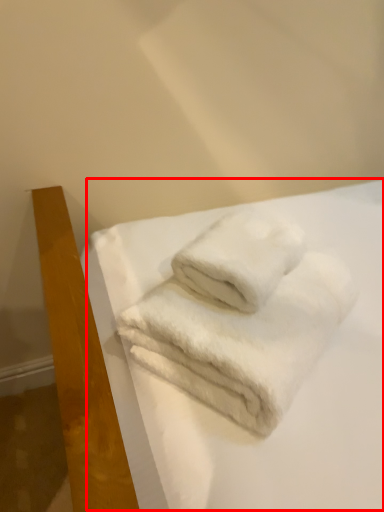
Question: In this image, where is sheet (annotated by the red box) located relative to towel?

Choices:
 (A) left
 (B) right

Answer: (B)